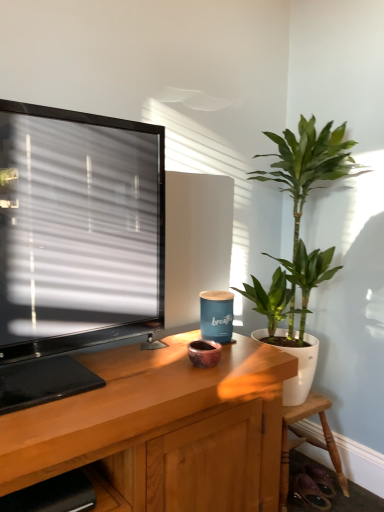
Question: Is green glossy plant at right inside wooden chair at lower right?

Choices:
 (A) yes
 (B) no

Answer: (B)

Question: Considering the relative positions of wooden chair at lower right and green glossy plant at right in the image provided, is wooden chair at lower right in front of green glossy plant at right?

Choices:
 (A) yes
 (B) no

Answer: (B)

Question: Considering the relative sizes of wooden chair at lower right and green glossy plant at right in the image provided, is wooden chair at lower right thinner than green glossy plant at right?

Choices:
 (A) yes
 (B) no

Answer: (A)

Question: Is wooden chair at lower right to the right of green glossy plant at right from the viewer's perspective?

Choices:
 (A) yes
 (B) no

Answer: (A)

Question: Is wooden chair at lower right turned away from green glossy plant at right?

Choices:
 (A) yes
 (B) no

Answer: (B)

Question: Is point (299, 270) positioned closer to the camera than point (294, 414)?

Choices:
 (A) closer
 (B) farther

Answer: (B)

Question: In terms of width, does green glossy plant at right look wider or thinner when compared to wooden chair at lower right?

Choices:
 (A) thin
 (B) wide

Answer: (B)

Question: In the image, is green glossy plant at right on the left side or the right side of wooden chair at lower right?

Choices:
 (A) left
 (B) right

Answer: (A)

Question: Would you say green glossy plant at right is inside or outside wooden chair at lower right?

Choices:
 (A) inside
 (B) outside

Answer: (B)

Question: Visually, is wooden chair at lower right positioned to the left or to the right of wooden shelf at lower left?

Choices:
 (A) right
 (B) left

Answer: (A)

Question: Based on their sizes in the image, would you say wooden chair at lower right is bigger or smaller than wooden shelf at lower left?

Choices:
 (A) big
 (B) small

Answer: (B)

Question: From the image's perspective, is wooden chair at lower right above or below wooden shelf at lower left?

Choices:
 (A) below
 (B) above

Answer: (A)

Question: In terms of height, does wooden chair at lower right look taller or shorter compared to wooden shelf at lower left?

Choices:
 (A) tall
 (B) short

Answer: (A)

Question: From the image's perspective, is wooden chair at lower right located above or below green glossy plant at right?

Choices:
 (A) above
 (B) below

Answer: (B)

Question: Is point (281, 434) positioned closer to the camera than point (296, 175)?

Choices:
 (A) closer
 (B) farther

Answer: (A)